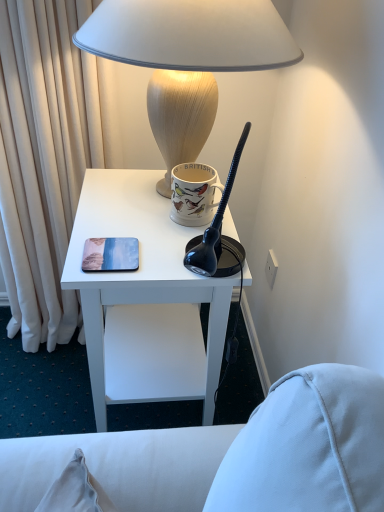
Identify the location of free region on the left part of matte ceramic mug at upper center. Image resolution: width=384 pixels, height=512 pixels. (129, 210).